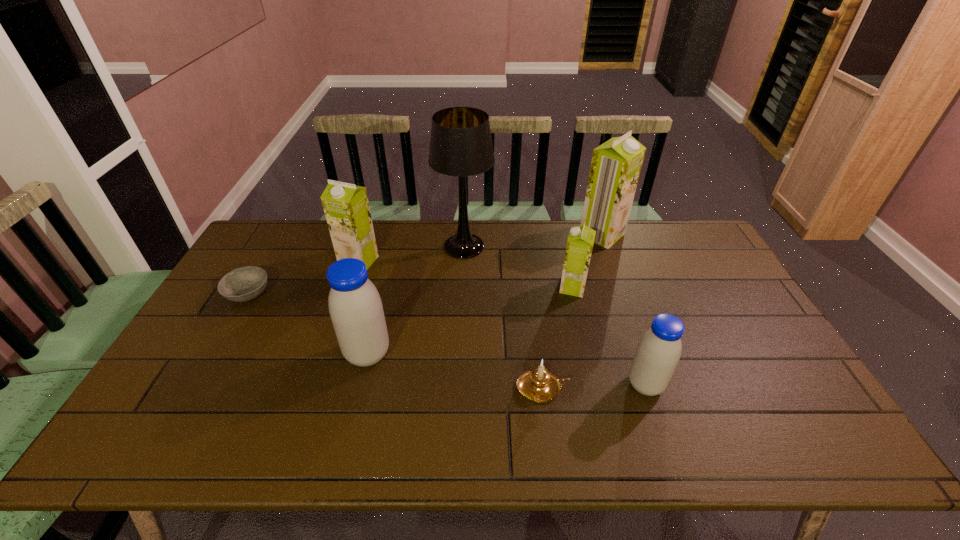
What are the coordinates of `candle holder` in the screenshot? It's located at (539, 385).

What are the coordinates of `the second shortest object` in the screenshot? It's located at (539, 385).

You are a GUI agent. You are given a task and a screenshot of the screen. Output one action in this format:
    pyautogui.click(x=<x>, y=<y>)
    Task: Click on the bowl
    
    Given the screenshot: What is the action you would take?
    pyautogui.click(x=243, y=284)

Find the location of a particular element. the shortest object is located at coordinates (243, 284).

Locate an element on the screen. vacant space located 0.350m on the left of the black table lamp is located at coordinates (335, 247).

Find the location of `blank space located 0.130m on the right of the tallest soya milk`. blank space located 0.130m on the right of the tallest soya milk is located at coordinates (660, 235).

I want to click on vacant space located 0.240m on the right of the second smallest green soya milk, so click(x=448, y=261).

Where is `vacant region located 0.370m on the right of the bigger blue soya milk`? Image resolution: width=960 pixels, height=540 pixels. vacant region located 0.370m on the right of the bigger blue soya milk is located at coordinates (529, 354).

You are a GUI agent. You are given a task and a screenshot of the screen. Output one action in this format:
    pyautogui.click(x=<x>, y=<y>)
    Task: Click on the free space located on the front of the smallest green soya milk
    Image resolution: width=960 pixels, height=540 pixels.
    Given the screenshot: What is the action you would take?
    pyautogui.click(x=586, y=343)

Locate an element on the screen. This screenshot has width=960, height=540. blank space located 0.150m on the right of the right blue soya milk is located at coordinates (724, 385).